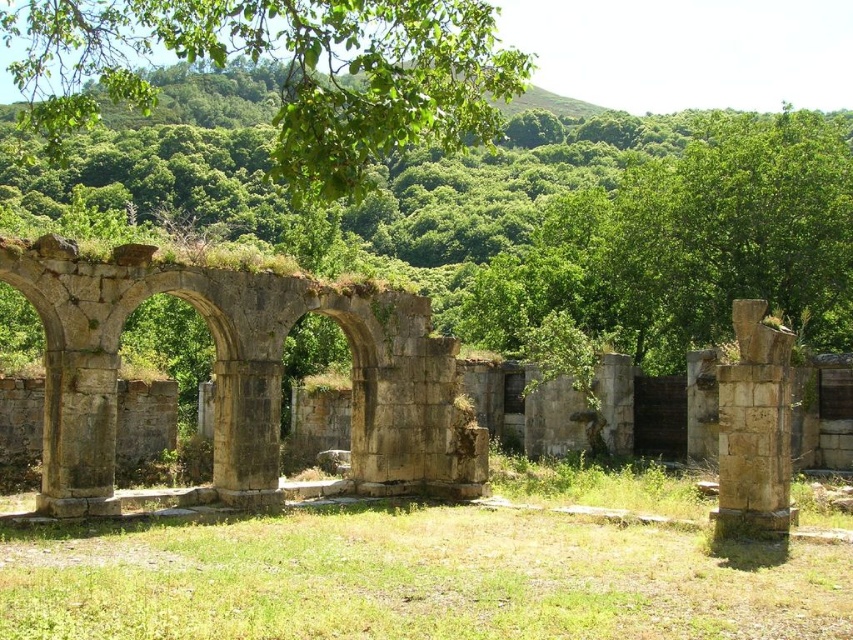
Is point (706, 307) positioned behind point (775, 483)?

Yes, point (706, 307) is behind point (775, 483).

Can you confirm if green leafy tree at center is positioned to the right of stone column at right?

Incorrect, green leafy tree at center is not on the right side of stone column at right.

The image size is (853, 640). In order to click on green leafy tree at center in this screenshot , I will do `click(627, 224)`.

Where is `green leafy tree at center`? green leafy tree at center is located at coordinates (627, 224).

Can you confirm if stone arches at center is positioned to the right of green leafy tree at upper center?

Indeed, stone arches at center is positioned on the right side of green leafy tree at upper center.

Between point (434, 378) and point (300, 19), which one is positioned behind?

The point (434, 378) is behind.

In order to click on stone arches at center in this screenshot , I will do `click(241, 378)`.

Between point (525, 125) and point (461, 81), which one is positioned behind?

The point (525, 125) is more distant.

Is green leafy tree at center to the right of green leafy tree at upper center from the viewer's perspective?

Yes, green leafy tree at center is to the right of green leafy tree at upper center.

Where is `green leafy tree at center`? The height and width of the screenshot is (640, 853). green leafy tree at center is located at coordinates (627, 224).